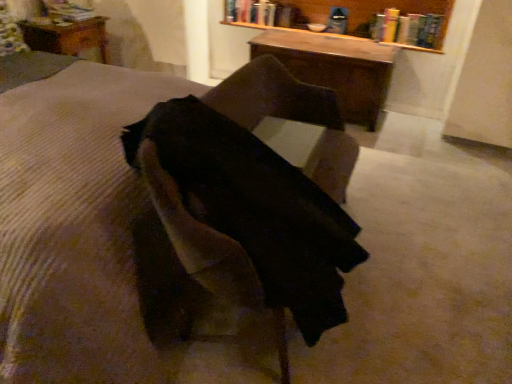
The width and height of the screenshot is (512, 384). Identify the location of free space above hardcover book at upper center, which is counted as the first book, starting from the right (from a real-world perspective). (423, 12).